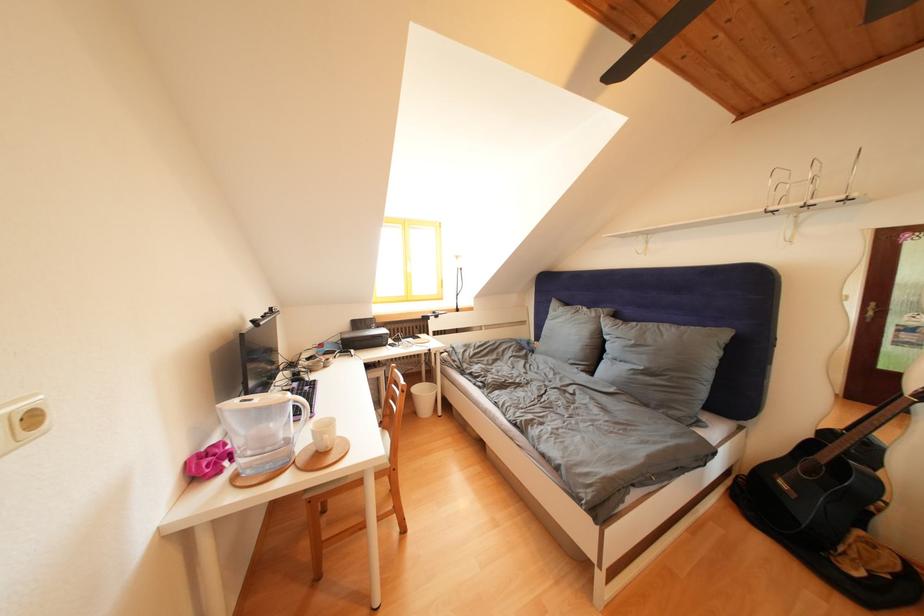
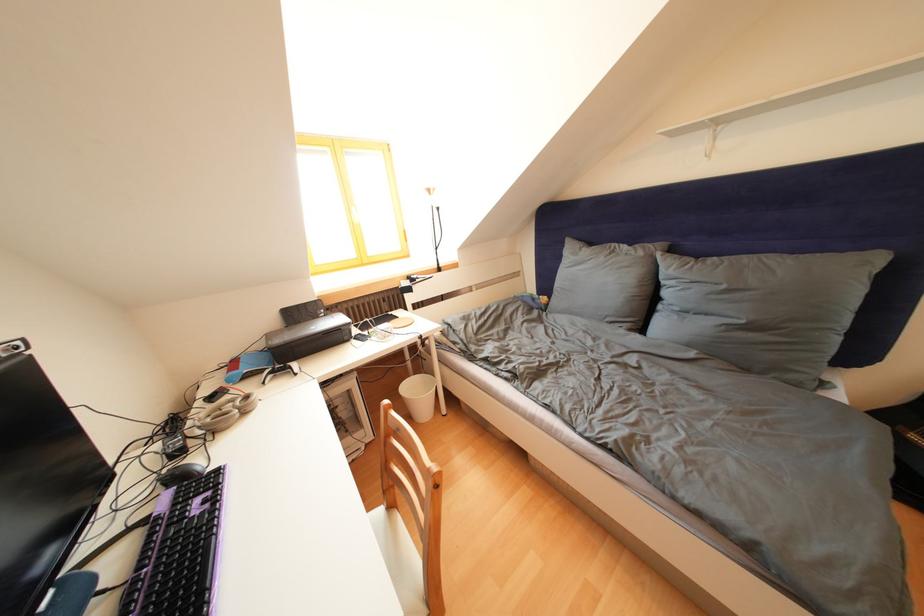
Locate, in the second image, the point that corresponds to point (317, 363) in the first image.

(220, 403)